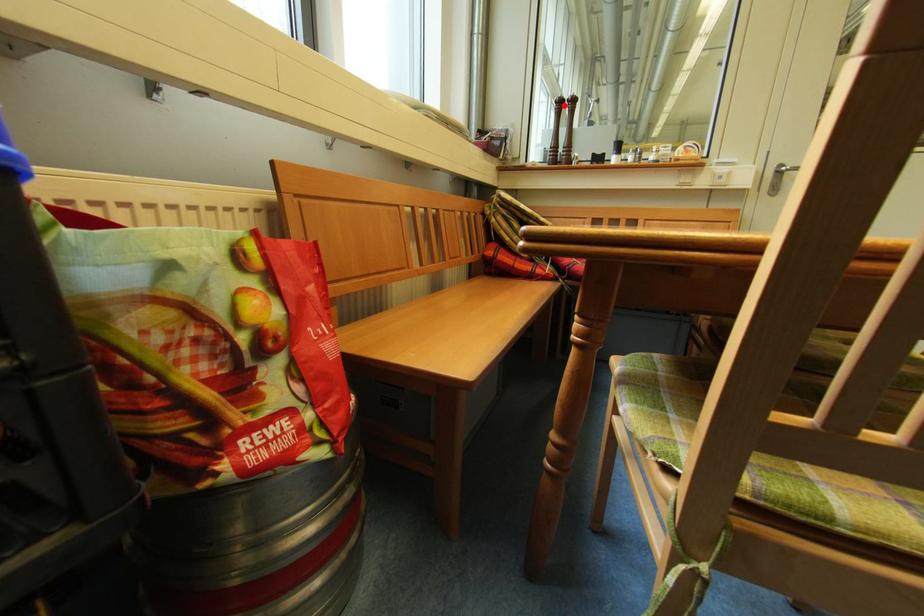
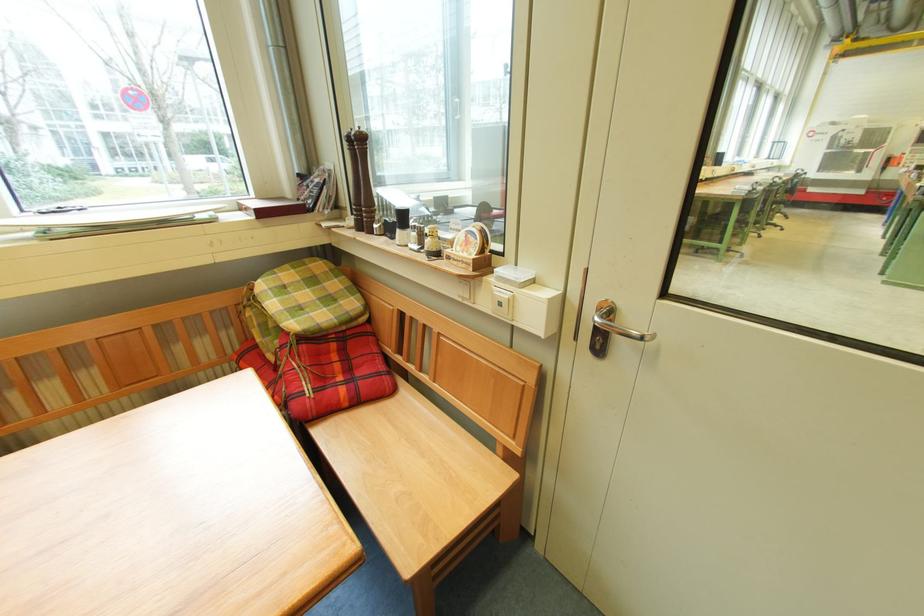
Where in the second image is the point corresponding to the highlighted location from the first image?

(354, 144)